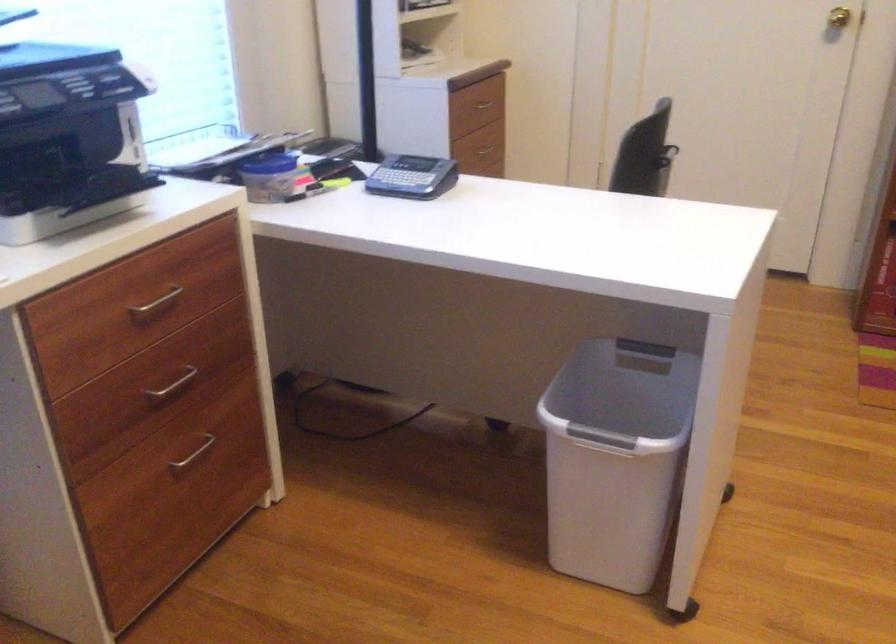
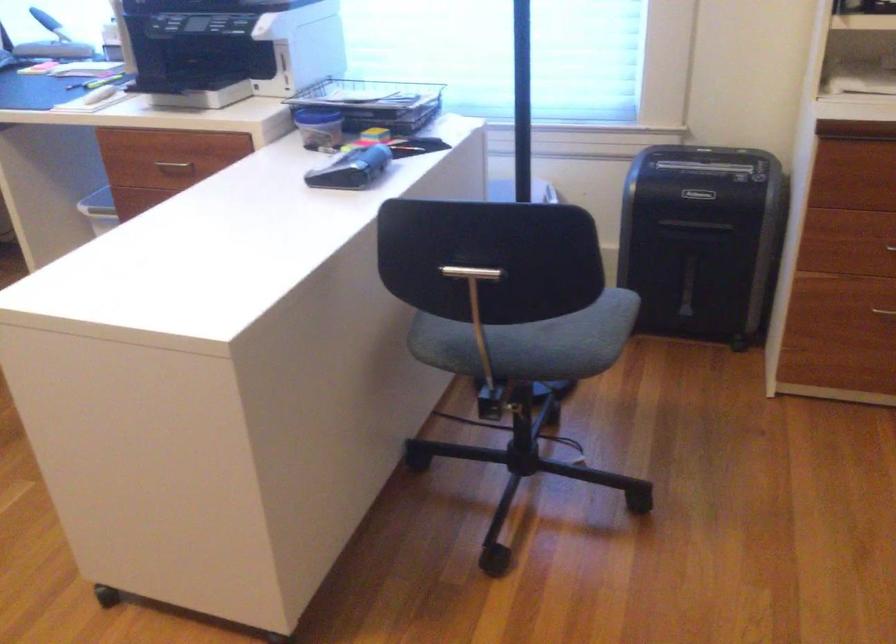
Question: I am providing you with two images of the same scene from different viewpoints. Please identify which objects are invisible in image2.

Choices:
 (A) shredder bin handle
 (B) metal drawer handle
 (C) glass utensil jar
 (D) chair sitting surface

Answer: (B)